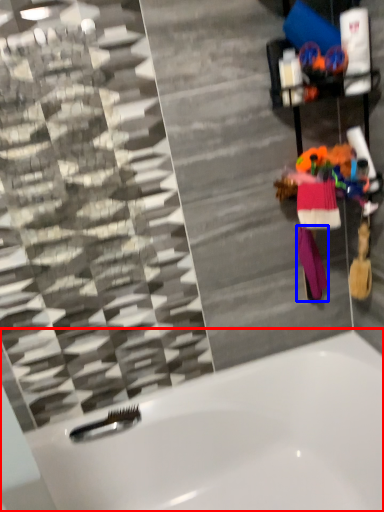
Question: Among these objects, which one is nearest to the camera, bathtub (highlighted by a red box) or clothing (highlighted by a blue box)?

Choices:
 (A) bathtub
 (B) clothing

Answer: (A)